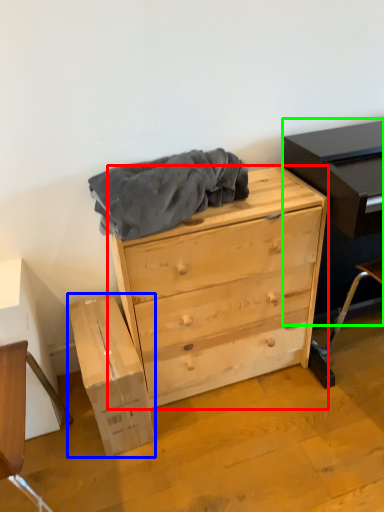
Question: Which is nearer to the chest of drawers (highlighted by a red box)? cardboard box (highlighted by a blue box) or entertainment center (highlighted by a green box).

Choices:
 (A) cardboard box
 (B) entertainment center

Answer: (B)